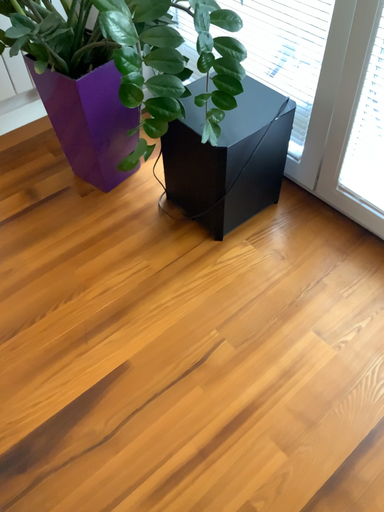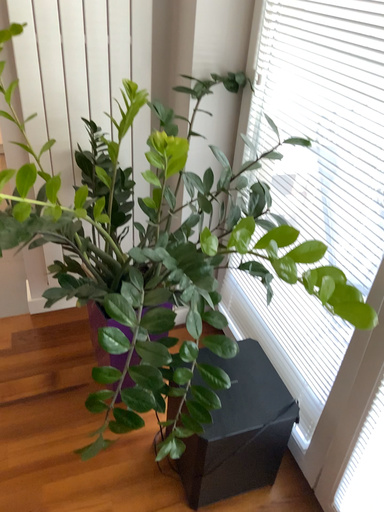
Question: Which way did the camera rotate in the video?

Choices:
 (A) rotated upward
 (B) rotated downward

Answer: (A)